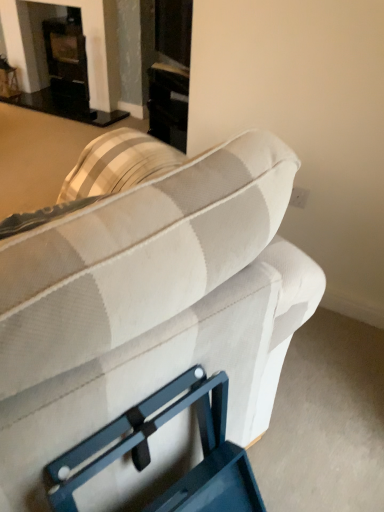
Question: Does beige fabric couch at center have a greater width compared to black glass fireplace at upper left?

Choices:
 (A) no
 (B) yes

Answer: (B)

Question: Considering the relative sizes of beige fabric couch at center and black glass fireplace at upper left in the image provided, is beige fabric couch at center thinner than black glass fireplace at upper left?

Choices:
 (A) yes
 (B) no

Answer: (B)

Question: From a real-world perspective, is beige fabric couch at center located beneath black glass fireplace at upper left?

Choices:
 (A) yes
 (B) no

Answer: (B)

Question: From the image's perspective, is beige fabric couch at center located beneath black glass fireplace at upper left?

Choices:
 (A) yes
 (B) no

Answer: (A)

Question: Is beige fabric couch at center positioned beyond the bounds of black glass fireplace at upper left?

Choices:
 (A) yes
 (B) no

Answer: (A)

Question: Does beige fabric couch at center appear on the left side of black glass fireplace at upper left?

Choices:
 (A) no
 (B) yes

Answer: (A)

Question: Considering the relative sizes of black glass fireplace at upper left and beige fabric couch at center in the image provided, is black glass fireplace at upper left thinner than beige fabric couch at center?

Choices:
 (A) no
 (B) yes

Answer: (B)

Question: Is black glass fireplace at upper left taller than beige fabric couch at center?

Choices:
 (A) yes
 (B) no

Answer: (B)

Question: From the image's perspective, is black glass fireplace at upper left on top of beige fabric couch at center?

Choices:
 (A) no
 (B) yes

Answer: (B)

Question: Is black glass fireplace at upper left to the right of beige fabric couch at center from the viewer's perspective?

Choices:
 (A) yes
 (B) no

Answer: (B)

Question: Considering the relative sizes of black glass fireplace at upper left and beige fabric couch at center in the image provided, is black glass fireplace at upper left bigger than beige fabric couch at center?

Choices:
 (A) no
 (B) yes

Answer: (A)

Question: Is black glass fireplace at upper left not close to beige fabric couch at center?

Choices:
 (A) no
 (B) yes

Answer: (B)

Question: In terms of size, does beige fabric couch at center appear bigger or smaller than black glass fireplace at upper left?

Choices:
 (A) small
 (B) big

Answer: (B)